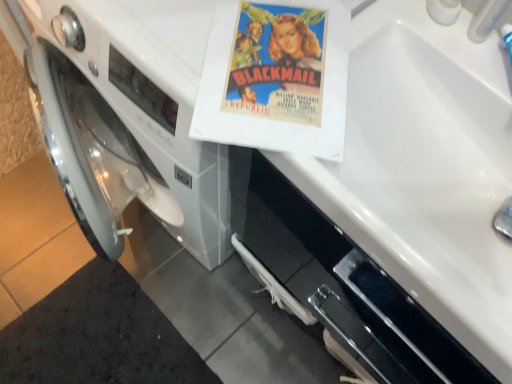
Identify the location of free space to the left of white plastic faucet at upper right. (410, 30).